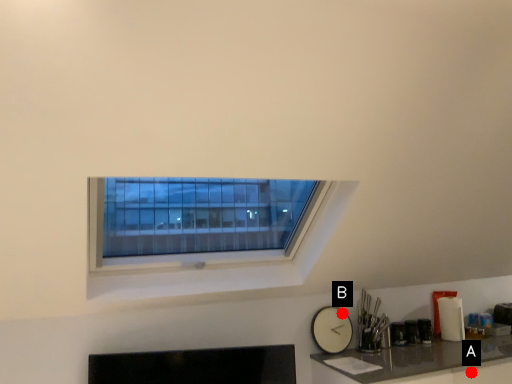
Question: Two points are circled on the image, labeled by A and B beside each circle. Among these points, which one is farthest from the camera?

Choices:
 (A) A is further
 (B) B is further

Answer: (B)